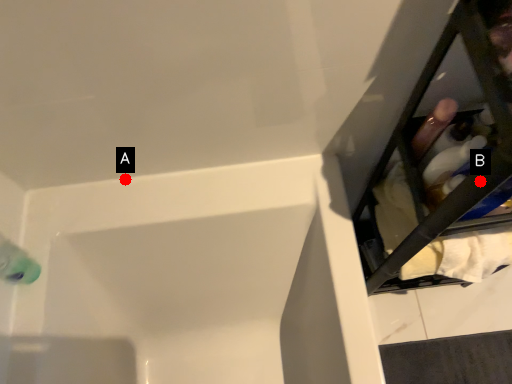
Question: Two points are circled on the image, labeled by A and B beside each circle. Which point is closer to the camera taking this photo?

Choices:
 (A) A is closer
 (B) B is closer

Answer: (B)